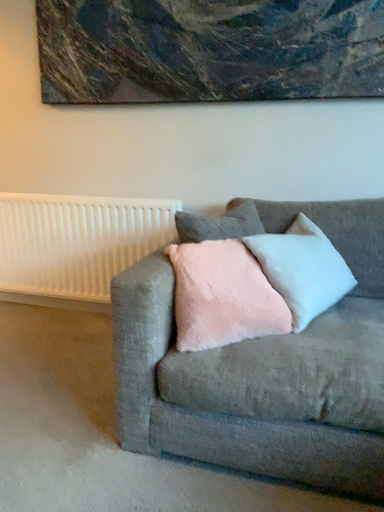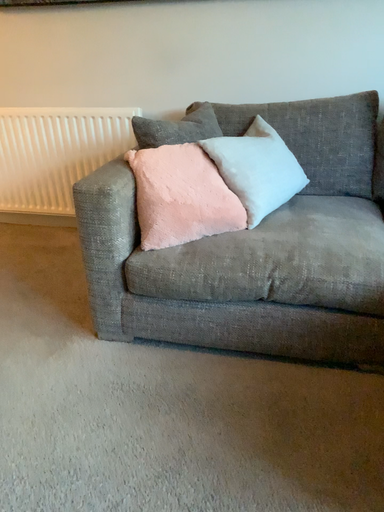
Question: Which way did the camera rotate in the video?

Choices:
 (A) rotated downward
 (B) rotated upward

Answer: (A)